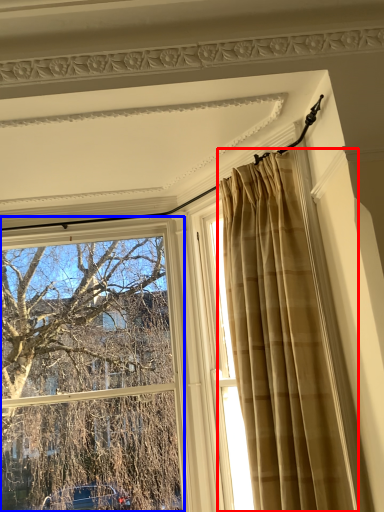
Question: Which point is further to the camera, curtain (highlighted by a red box) or window (highlighted by a blue box)?

Choices:
 (A) curtain
 (B) window

Answer: (B)